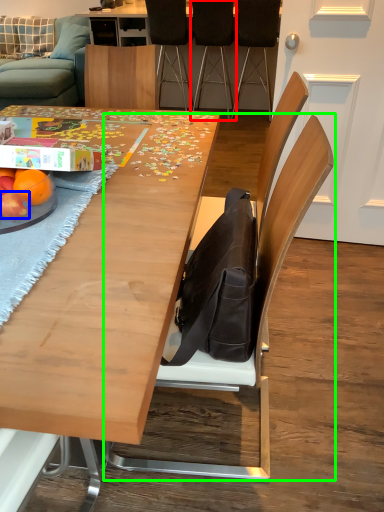
Question: Which object is positioned closest to chair (highlighted by a red box)? Select from apple (highlighted by a blue box) and chair (highlighted by a green box).

Choices:
 (A) apple
 (B) chair

Answer: (B)